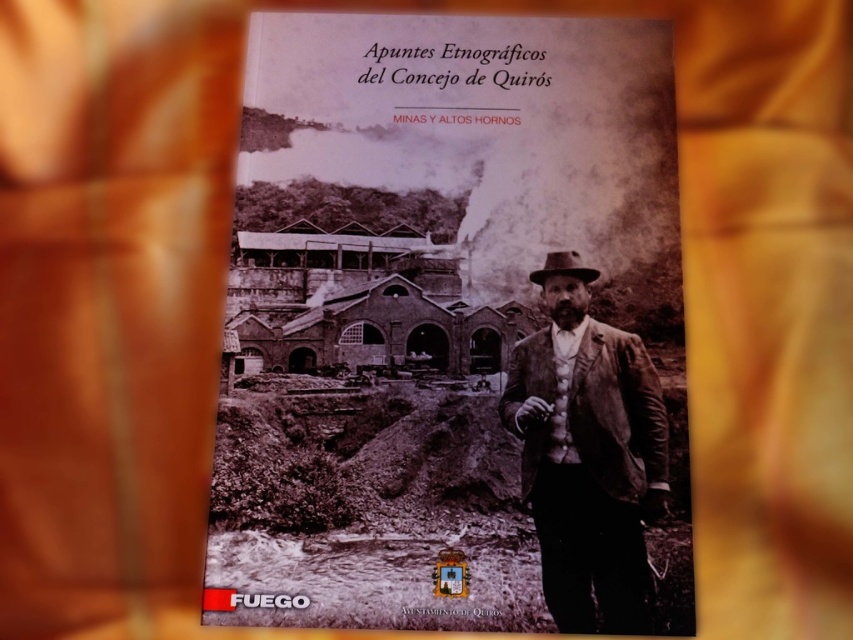
Does point (630, 433) come closer to viewer compared to point (543, 506)?

No, it is behind (543, 506).

Does sepia paper book cover at center lie in front of brown leather jacket at right?

Yes, it is.

What do you see at coordinates (444, 321) in the screenshot? I see `sepia paper book cover at center` at bounding box center [444, 321].

You are a GUI agent. You are given a task and a screenshot of the screen. Output one action in this format:
    pyautogui.click(x=<x>, y=<y>)
    Task: Click on the sepia paper book cover at center
    
    Given the screenshot: What is the action you would take?
    pyautogui.click(x=444, y=321)